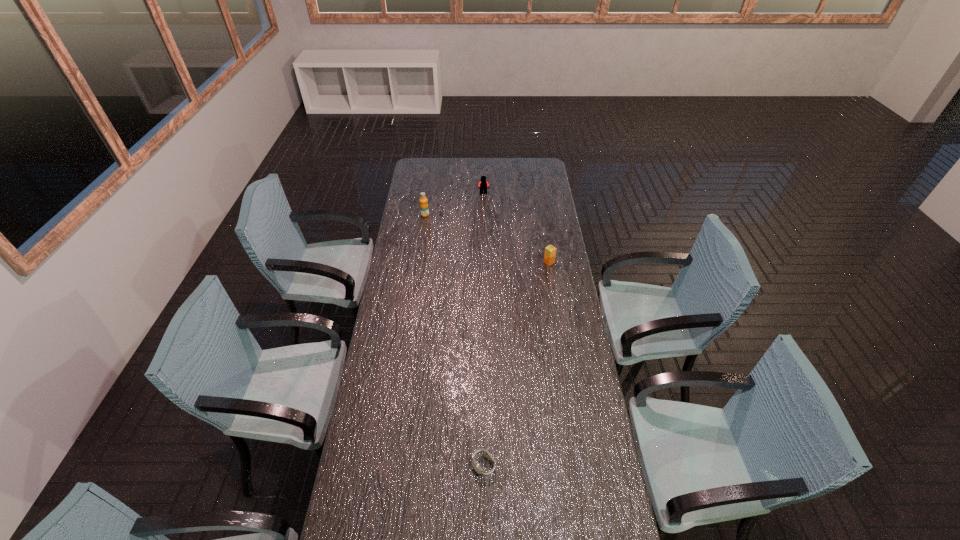
Locate an element on the screen. Image resolution: width=960 pixels, height=540 pixels. free region located on the face of the shortest object is located at coordinates (484, 538).

Where is `object that is at the left edge`? object that is at the left edge is located at coordinates (424, 208).

Locate an element on the screen. The height and width of the screenshot is (540, 960). object present at the right edge is located at coordinates [550, 251].

You are a GUI agent. You are given a task and a screenshot of the screen. Output one action in this format:
    pyautogui.click(x=<x>, y=<y>)
    Task: Click on the vacant space at the far edge
    
    Given the screenshot: What is the action you would take?
    pyautogui.click(x=462, y=170)

I want to click on vacant space at the left edge of the desktop, so pos(379,407).

You are a GUI agent. You are given a task and a screenshot of the screen. Output one action in this format:
    pyautogui.click(x=<x>, y=<y>)
    Task: Click on the vacant space at the right edge of the desktop
    
    Given the screenshot: What is the action you would take?
    pyautogui.click(x=560, y=251)

Where is `vacant space in between the farthest object and the third farthest object`? vacant space in between the farthest object and the third farthest object is located at coordinates (516, 228).

Find the location of a particular element. vacant space that is in between the Lego and the nearest object is located at coordinates (484, 329).

Locate an element on the screen. vacant region between the Lego and the rightmost object is located at coordinates (516, 228).

At what (x,y) coordinates should I click in order to perform the action: click on free spot between the watch and the rightmost object. Please return your answer as a coordinate pair (x, y). The image size is (960, 540). Looking at the image, I should click on [x=516, y=363].